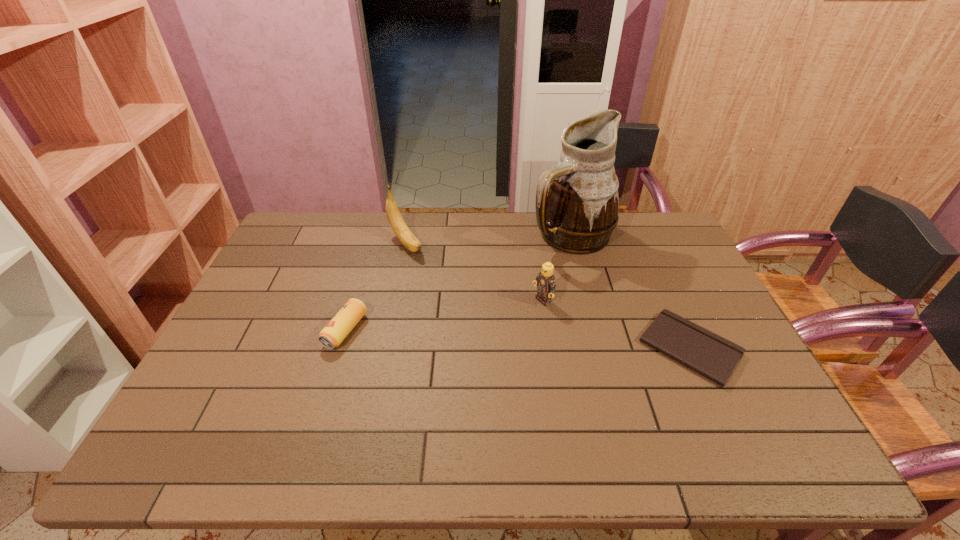
Locate an element on the screen. This screenshot has width=960, height=540. free spot between the fourth shortest object and the tallest object is located at coordinates (488, 240).

The image size is (960, 540). Identify the location of unoccupied area between the third nearest object and the second shortest object. (444, 316).

Find the location of `vacant space that's between the third farthest object and the fourth shortest object`. vacant space that's between the third farthest object and the fourth shortest object is located at coordinates (474, 273).

Identify the location of free space between the shortest object and the third nearest object. (616, 325).

Point out which object is positioned as the second nearest to the tallest object. Please provide its 2D coordinates. Your answer should be formatted as a tuple, i.e. [(x, y)], where the tuple contains the x and y coordinates of a point satisfying the conditions above.

[(712, 356)]

Choose which object is the nearest neighbor to the tallest object. Please provide its 2D coordinates. Your answer should be formatted as a tuple, i.e. [(x, y)], where the tuple contains the x and y coordinates of a point satisfying the conditions above.

[(545, 281)]

Find the location of a particular element. The height and width of the screenshot is (540, 960). blank space that satisfies the following two spatial constraints: 1. on the front side of the banana; 2. on the right side of the shortest object is located at coordinates (384, 348).